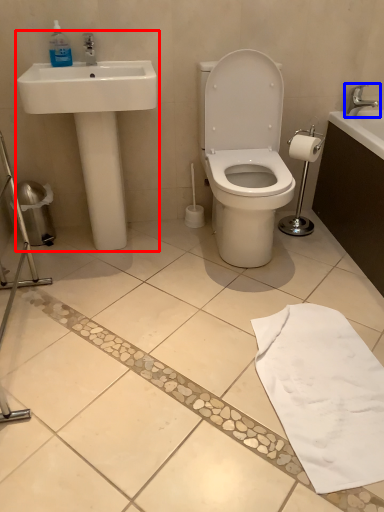
Question: Which of the following is the farthest to the observer, sink (highlighted by a red box) or tap (highlighted by a blue box)?

Choices:
 (A) sink
 (B) tap

Answer: (B)